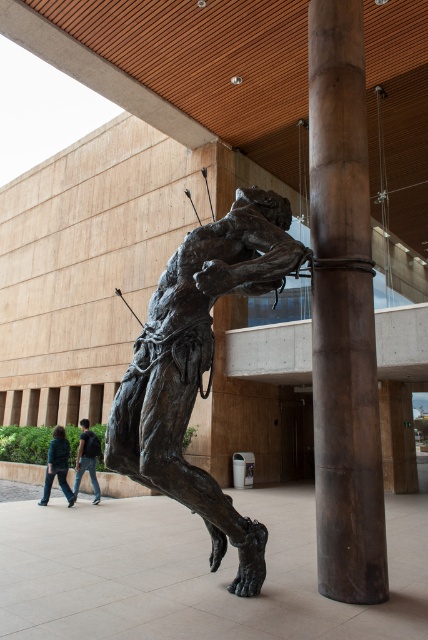
Question: Which object is positioned closest to the green denim jacket at lower left?

Choices:
 (A) bronze textured figure at center
 (B) jeans at lower left
 (C) smooth brown wood at center

Answer: (B)

Question: Is green denim jacket at lower left wider than jeans at lower left?

Choices:
 (A) yes
 (B) no

Answer: (A)

Question: Is green denim jacket at lower left wider than jeans at lower left?

Choices:
 (A) no
 (B) yes

Answer: (B)

Question: From the image, what is the correct spatial relationship of smooth brown wood at center in relation to bronze textured figure at center?

Choices:
 (A) right
 (B) left

Answer: (A)

Question: Among these objects, which one is nearest to the camera?

Choices:
 (A) jeans at lower left
 (B) bronze textured figure at center

Answer: (B)

Question: Estimate the real-world distances between objects in this image. Which object is farther from the bronze textured figure at center?

Choices:
 (A) jeans at lower left
 (B) green denim jacket at lower left
 (C) smooth brown wood at center

Answer: (A)